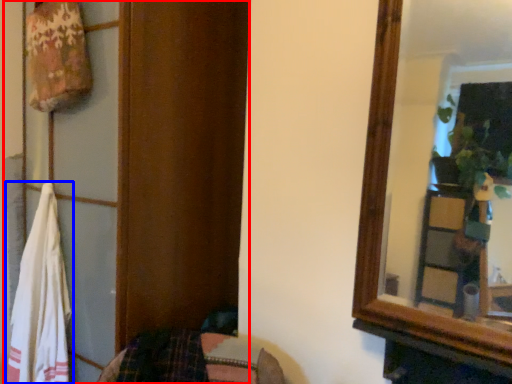
Question: Which object is further to the camera taking this photo, dresser (highlighted by a red box) or beach towel (highlighted by a blue box)?

Choices:
 (A) dresser
 (B) beach towel

Answer: (B)